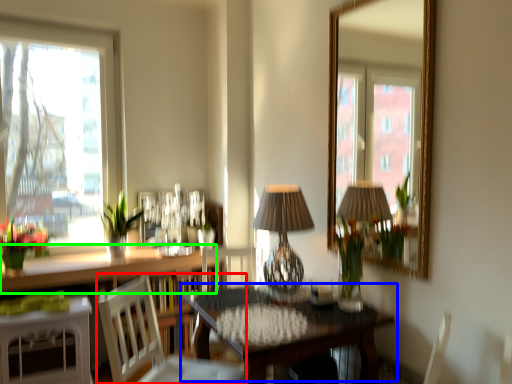
Question: Which is farther away from chair (highlighted by a red box)? table (highlighted by a blue box) or counter top (highlighted by a green box)?

Choices:
 (A) table
 (B) counter top

Answer: (B)